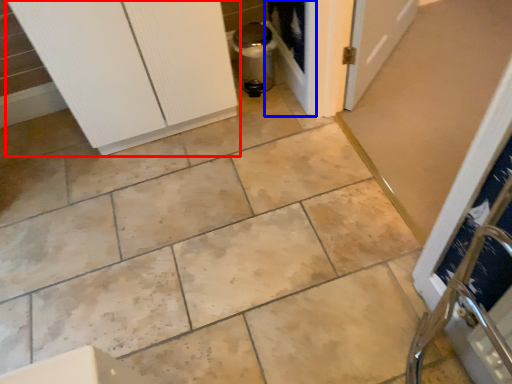
Question: Which object appears closest to the camera in this image, door (highlighted by a red box) or screen door (highlighted by a blue box)?

Choices:
 (A) door
 (B) screen door

Answer: (A)